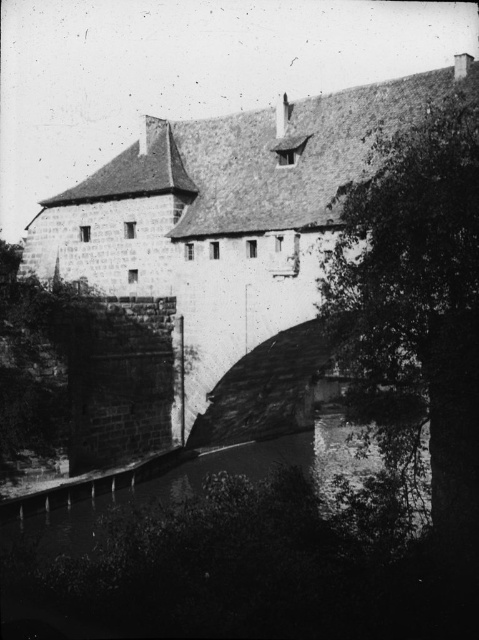
Question: Which point is closer to the camera?

Choices:
 (A) (343, 173)
 (B) (434, 115)

Answer: (B)

Question: Considering the relative positions of stone wall at center and green leafy tree at right in the image provided, where is stone wall at center located with respect to green leafy tree at right?

Choices:
 (A) above
 (B) below

Answer: (A)

Question: Can you confirm if stone wall at center is bigger than green leafy tree at right?

Choices:
 (A) no
 (B) yes

Answer: (B)

Question: Which object is farther from the camera taking this photo?

Choices:
 (A) stone wall at center
 (B) green leafy tree at right

Answer: (A)

Question: Among these objects, which one is farthest from the camera?

Choices:
 (A) stone wall at center
 (B) green leafy tree at right

Answer: (A)

Question: Is stone wall at center smaller than green leafy tree at right?

Choices:
 (A) yes
 (B) no

Answer: (B)